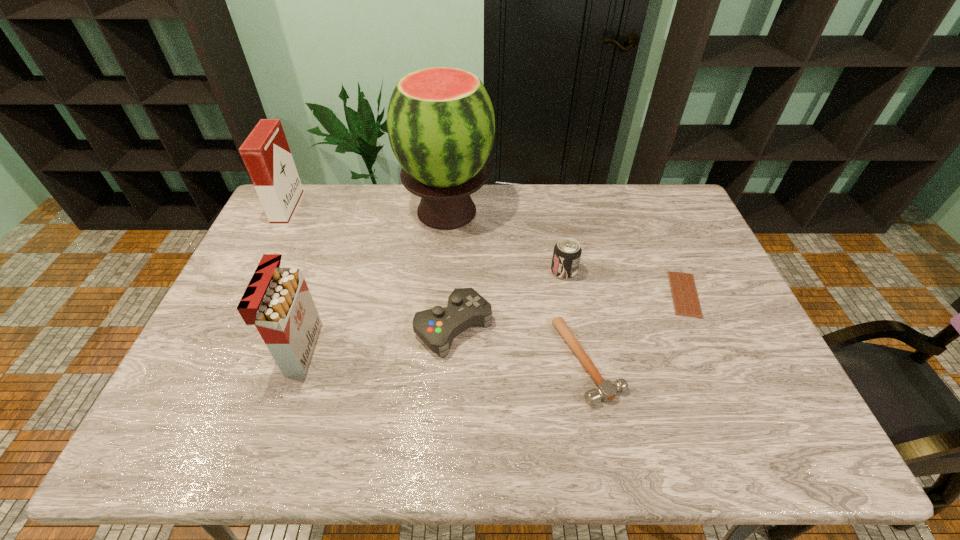
The height and width of the screenshot is (540, 960). Identify the location of object that is at the right edge. (684, 293).

Where is `object that is positioned at the far left corner`? object that is positioned at the far left corner is located at coordinates (266, 154).

You are a GUI agent. You are given a task and a screenshot of the screen. Output one action in this format:
    pyautogui.click(x=<x>, y=<y>)
    Task: Click on the free space at the far edge of the desktop
    
    Given the screenshot: What is the action you would take?
    pyautogui.click(x=324, y=206)

Locate an element on the screen. This screenshot has height=540, width=960. vacant space at the near edge of the desktop is located at coordinates [x=415, y=423].

Identify the location of vacant space at the left edge. This screenshot has height=540, width=960. (211, 400).

The image size is (960, 540). Identify the location of vacant space at the right edge of the desktop. (686, 249).

Identify the location of vacant space at the far right corner. click(648, 207).

The height and width of the screenshot is (540, 960). Find the location of `free point between the watermelon and the fifth tallest object`. free point between the watermelon and the fifth tallest object is located at coordinates (450, 269).

This screenshot has height=540, width=960. Identify the location of vacant point located between the fifth tallest object and the watermelon. (450, 269).

I want to click on free space between the fourth shortest object and the tallest object, so click(506, 241).